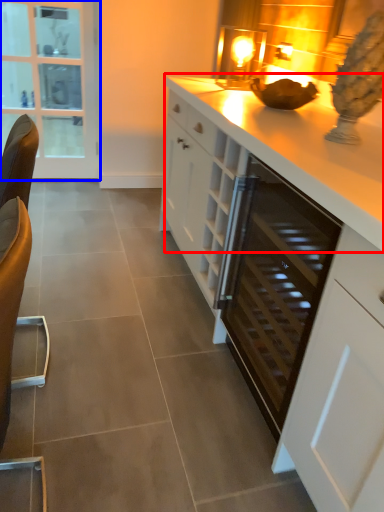
Question: Which object appears farthest to the camera in this image, countertop (highlighted by a red box) or glass door (highlighted by a blue box)?

Choices:
 (A) countertop
 (B) glass door

Answer: (B)